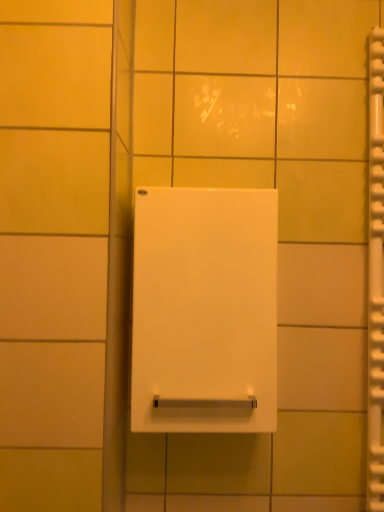
This screenshot has height=512, width=384. What do you see at coordinates (204, 311) in the screenshot? I see `white glossy cabinet at center` at bounding box center [204, 311].

The height and width of the screenshot is (512, 384). I want to click on white glossy cabinet at center, so click(204, 311).

Locate an element on the screen. This screenshot has height=512, width=384. white glossy cabinet at center is located at coordinates (204, 311).